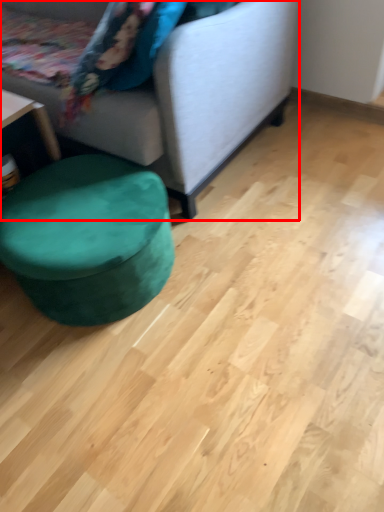
Question: Observing the image, what is the correct spatial positioning of studio couch (annotated by the red box) in reference to music stool?

Choices:
 (A) left
 (B) right

Answer: (A)